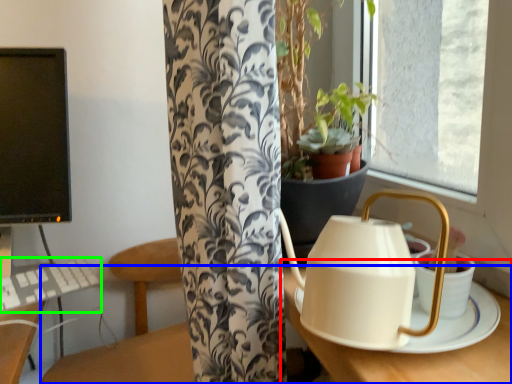
Question: Considering the real-world distances, which object is farthest from round table (highlighted by a red box)? table (highlighted by a blue box) or keyboard (highlighted by a green box)?

Choices:
 (A) table
 (B) keyboard

Answer: (B)